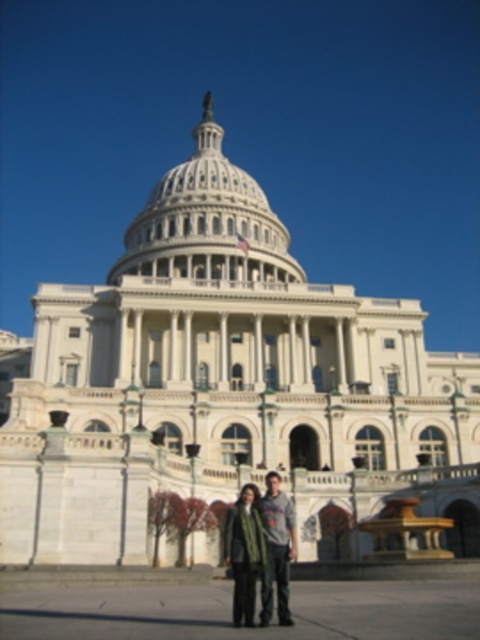
Can you confirm if white marble dome at center is positioned to the left of dark gray sweater at center?

Correct, you'll find white marble dome at center to the left of dark gray sweater at center.

Is white marble dome at center further to the viewer compared to dark gray sweater at center?

Yes, white marble dome at center is further from the viewer.

Is point (249, 198) in front of point (259, 556)?

No, it is behind (259, 556).

What are the coordinates of `white marble dome at center` in the screenshot? It's located at (206, 220).